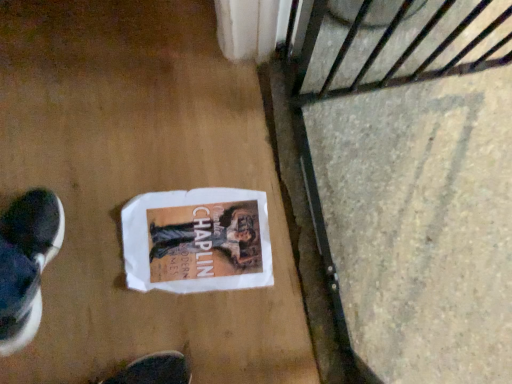
This screenshot has width=512, height=384. I want to click on white paper comic book at center, so click(x=197, y=240).

What do you see at coordinates (197, 240) in the screenshot? I see `white paper comic book at center` at bounding box center [197, 240].

At what (x,y) coordinates should I click in order to perform the action: click on white paper comic book at center. Please return your answer as a coordinate pair (x, y). The image size is (512, 384). Looking at the image, I should click on [197, 240].